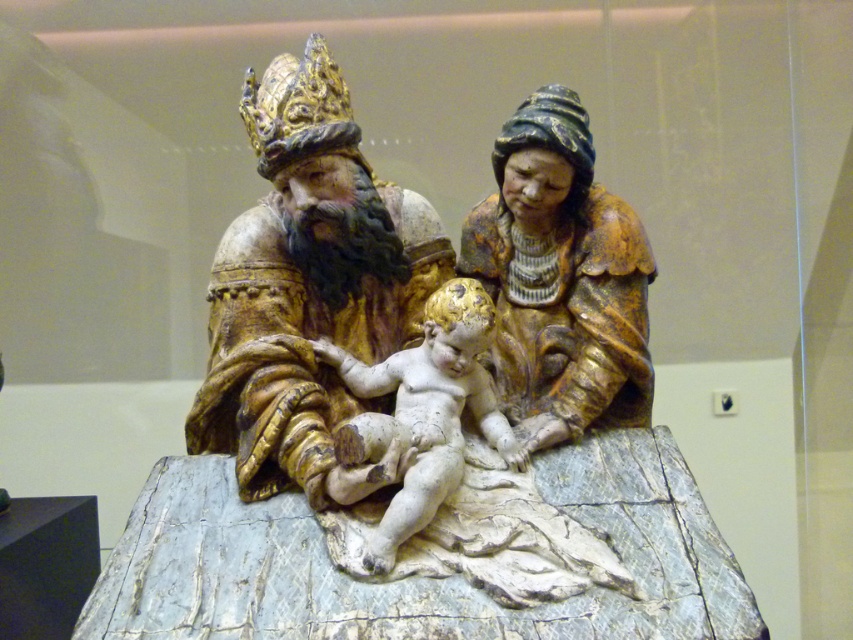
Is gold-painted wood sculpture of the holy family at center positioned behind white matte baby at center?

Answer: Yes.

Is gold-painted wood sculpture of the holy family at center bigger than white matte baby at center?

No.

The image size is (853, 640). I want to click on gold-painted wood sculpture of the holy family at center, so click(x=424, y=340).

Does gold-painted wood figure at center-left appear over white matte baby at center?

Indeed, gold-painted wood figure at center-left is positioned over white matte baby at center.

Between gold-painted wood figure at center-left and white matte baby at center, which one has less height?

white matte baby at center is shorter.

What do you see at coordinates (308, 288) in the screenshot? I see `gold-painted wood figure at center-left` at bounding box center [308, 288].

Identify the location of gold-painted wood figure at center-left. (308, 288).

Who is positioned more to the right, gold-painted wood sculpture of the holy family at center or matte gold statue at center?

matte gold statue at center

Between point (358, 280) and point (637, 228), which one is positioned in front?

Point (637, 228) is in front.

The image size is (853, 640). What do you see at coordinates (424, 340) in the screenshot?
I see `gold-painted wood sculpture of the holy family at center` at bounding box center [424, 340].

The width and height of the screenshot is (853, 640). Find the location of `gold-painted wood sculpture of the holy family at center`. gold-painted wood sculpture of the holy family at center is located at coordinates (424, 340).